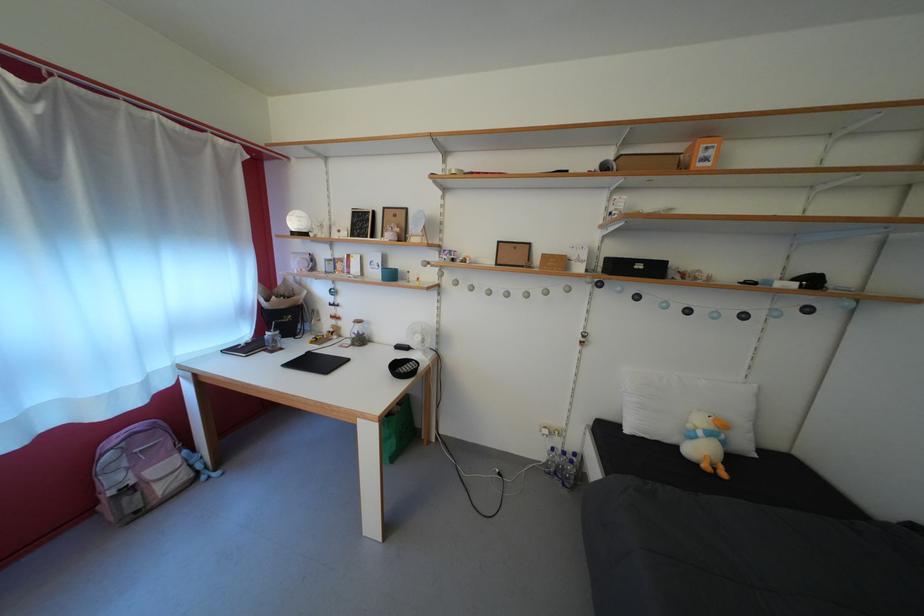
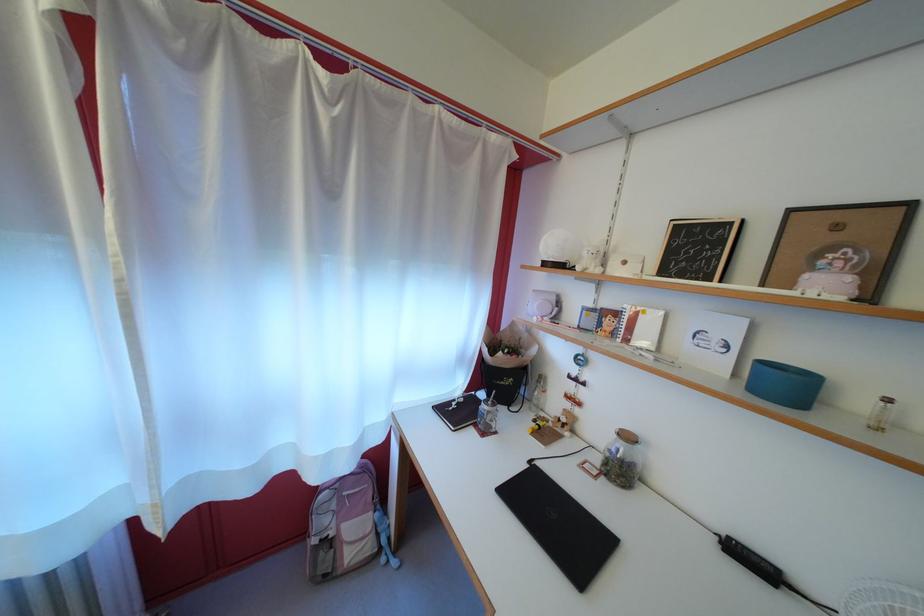
In the second image, find the point that corresponds to (368,328) in the first image.

(637, 444)